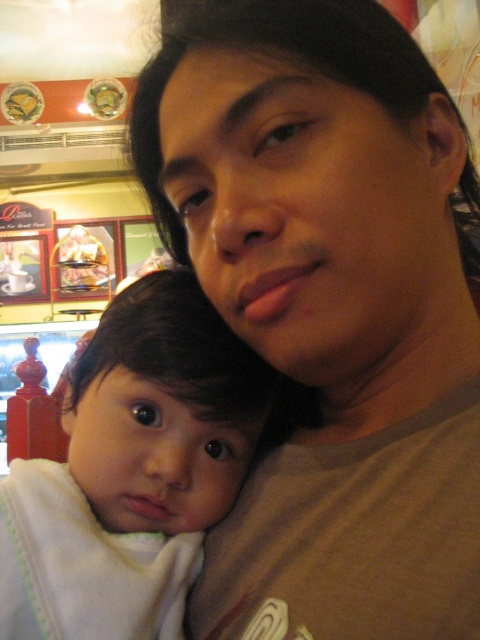
Between matte brown shirt at center and white soft baby at center, which one has less height?

white soft baby at center

Who is positioned more to the left, matte brown shirt at center or white soft baby at center?

From the viewer's perspective, white soft baby at center appears more on the left side.

Where is `matte brown shirt at center`? The image size is (480, 640). matte brown shirt at center is located at coordinates (328, 308).